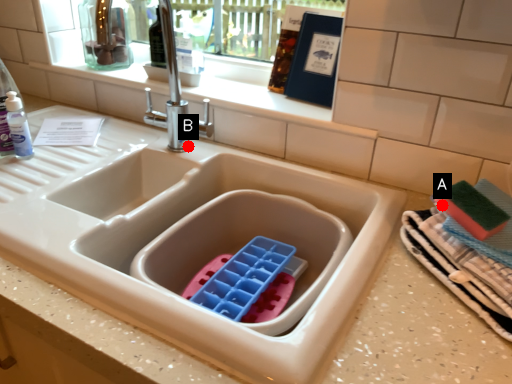
Question: Two points are circled on the image, labeled by A and B beside each circle. Which point is further to the camera?

Choices:
 (A) A is further
 (B) B is further

Answer: (B)